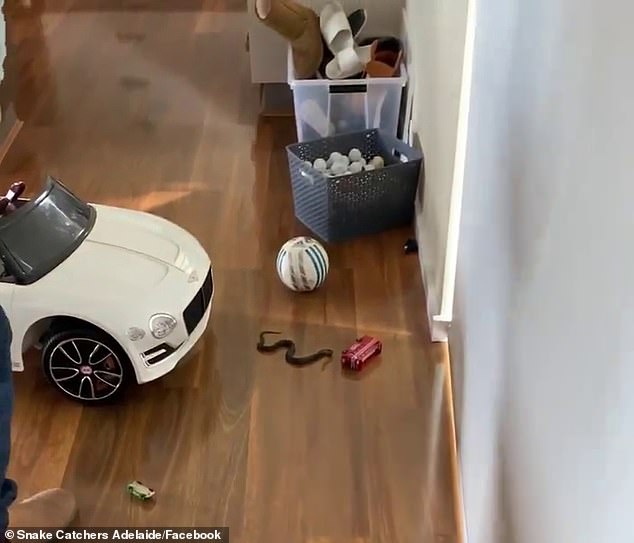
Identify the location of toy car. The height and width of the screenshot is (543, 634). (130, 307).